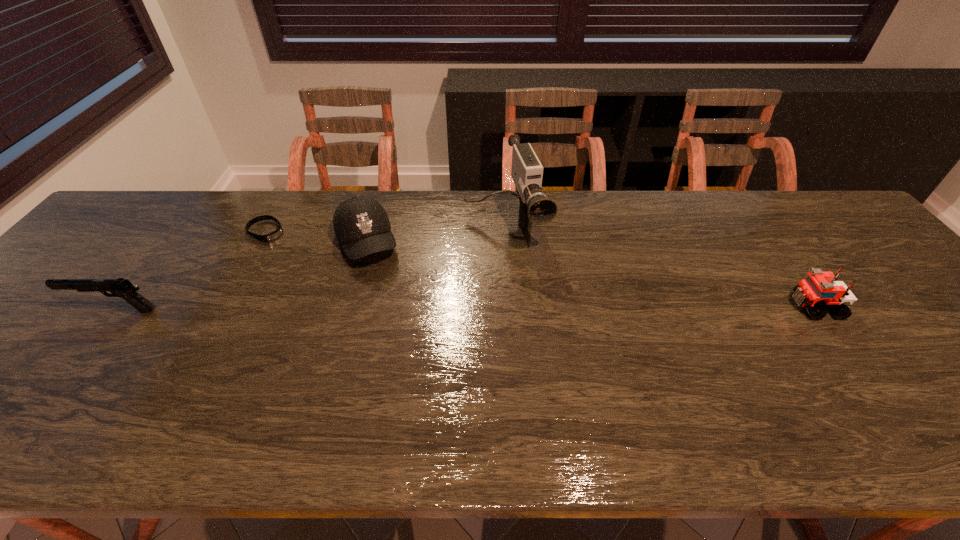
Identify the location of free space between the third object from left to right and the leftmost object. This screenshot has height=540, width=960. (241, 276).

Find the location of a particular element. vacant point located between the third object from left to right and the fourth object from left to right is located at coordinates (436, 234).

Find the location of a particular element. The height and width of the screenshot is (540, 960). vacant space that is in between the third object from right to left and the second object from right to left is located at coordinates (436, 234).

I want to click on empty space that is in between the wristband and the leftmost object, so click(x=191, y=271).

Where is `free space that is in between the baseball cap and the gun`? This screenshot has height=540, width=960. free space that is in between the baseball cap and the gun is located at coordinates (241, 276).

You are a GUI agent. You are given a task and a screenshot of the screen. Output one action in this format:
    pyautogui.click(x=<x>, y=<y>)
    Task: Click on the object that stands as the third closest to the shortest object
    This screenshot has width=960, height=540.
    Given the screenshot: What is the action you would take?
    pyautogui.click(x=535, y=208)

Locate an element on the screen. Image resolution: width=960 pixels, height=540 pixels. object that ranks as the fourth closest to the Lego is located at coordinates (123, 288).

The image size is (960, 540). I want to click on free spot that satisfies the following two spatial constraints: 1. on the back side of the third object from right to left; 2. on the left side of the tallest object, so pos(372,226).